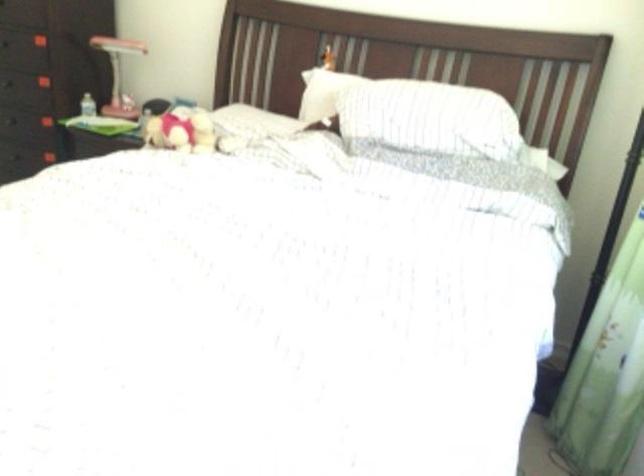
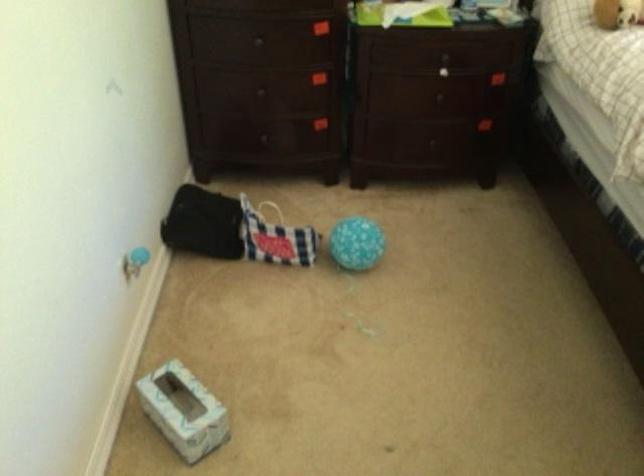
The point at (154, 144) is marked in the first image. Where is the corresponding point in the second image?

(617, 13)